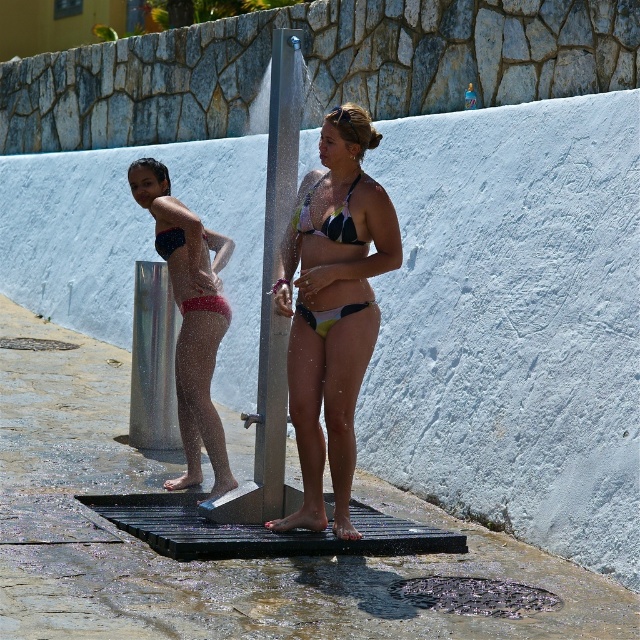
Question: Can you confirm if matte green bikini at center is positioned above silver metallic pole at center?

Choices:
 (A) yes
 (B) no

Answer: (B)

Question: Among these points, which one is farthest from the camera?

Choices:
 (A) (260, 321)
 (B) (321, 179)
 (C) (289, 266)
 (D) (342, 243)

Answer: (A)

Question: Observing the image, what is the correct spatial positioning of matte black bikini at left in reference to matte black bikini at center?

Choices:
 (A) left
 (B) right

Answer: (A)

Question: Estimate the real-world distances between objects in this image. Which object is farther from the matte black bikini at left?

Choices:
 (A) matte black bikini top at center
 (B) silver metallic pole at center

Answer: (A)

Question: Can you confirm if matte green bikini at center is positioned to the left of matte black bikini at left?

Choices:
 (A) no
 (B) yes

Answer: (A)

Question: Which of the following is the closest to the observer?

Choices:
 (A) (196, 218)
 (B) (326, 374)

Answer: (B)